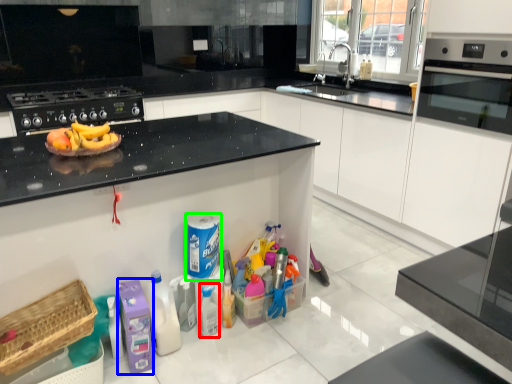
Question: Which is nearer to the bottle (highlighted by a red box)? cleaning product (highlighted by a blue box) or cleaning product (highlighted by a green box).

Choices:
 (A) cleaning product
 (B) cleaning product

Answer: (B)